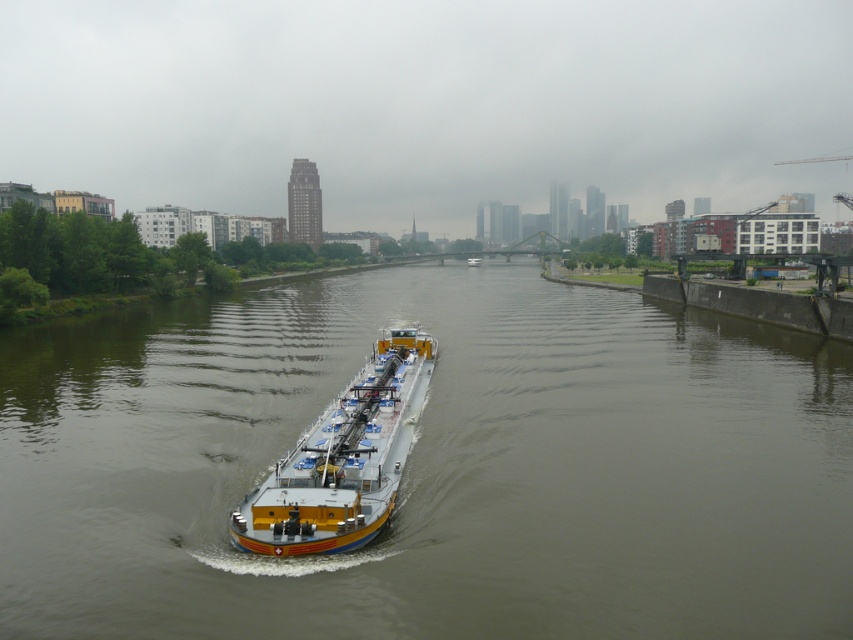
Question: Does smooth concrete river at center have a greater width compared to yellow matte barge at center?

Choices:
 (A) no
 (B) yes

Answer: (B)

Question: Which object appears farthest from the camera in this image?

Choices:
 (A) yellow metallic barge at center
 (B) yellow matte barge at center
 (C) smooth concrete river at center

Answer: (B)

Question: Which point is closer to the camera taking this photo?

Choices:
 (A) (379, 516)
 (B) (469, 266)
 (C) (131, 595)

Answer: (C)

Question: Can you confirm if smooth concrete river at center is positioned below yellow metallic barge at center?

Choices:
 (A) no
 (B) yes

Answer: (A)

Question: Estimate the real-world distances between objects in this image. Which object is farther from the yellow metallic barge at center?

Choices:
 (A) yellow matte barge at center
 (B) smooth concrete river at center

Answer: (A)

Question: Is yellow metallic barge at center smaller than yellow matte barge at center?

Choices:
 (A) no
 (B) yes

Answer: (B)